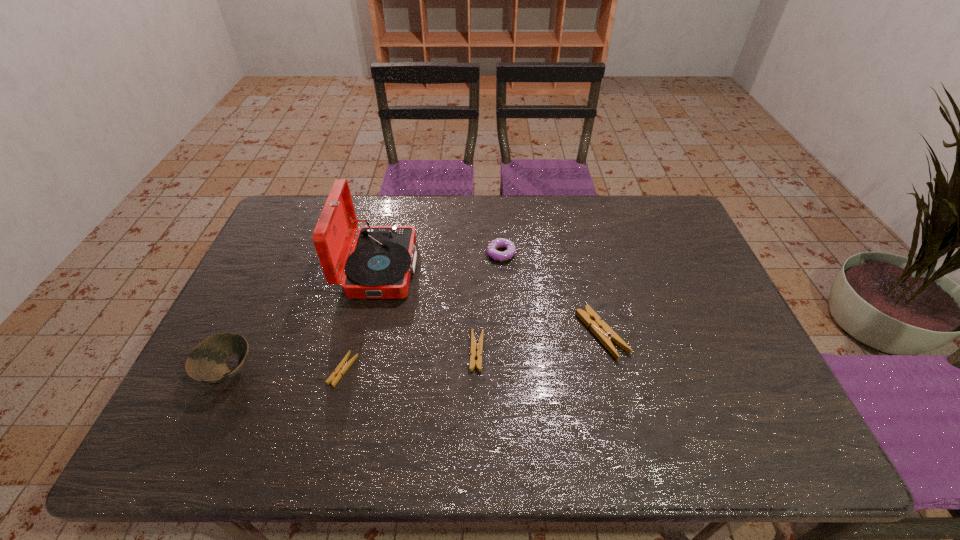
Image resolution: width=960 pixels, height=540 pixels. I want to click on free point that keeps the clothespins evenly spaced on the right, so pyautogui.click(x=718, y=318).